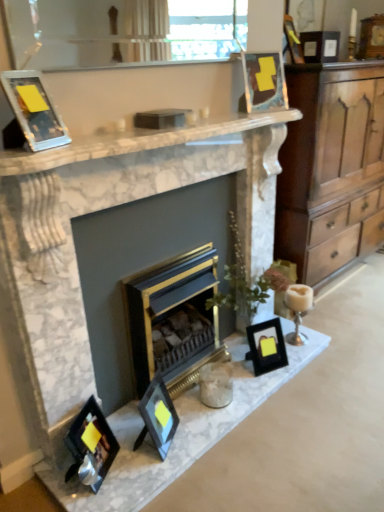
Question: Is the position of wooden picture frame at upper right, the 1th picture frame positioned from the back, less distant than that of marble fireplace at center, marked as the 2th fireplace in a right-to-left arrangement?

Choices:
 (A) no
 (B) yes

Answer: (A)

Question: Considering the relative sizes of wooden picture frame at upper right, placed as the seventh picture frame when sorted from left to right, and marble fireplace at center, marked as the first fireplace in a left-to-right arrangement, in the image provided, is wooden picture frame at upper right, placed as the seventh picture frame when sorted from left to right, taller than marble fireplace at center, marked as the first fireplace in a left-to-right arrangement,?

Choices:
 (A) no
 (B) yes

Answer: (A)

Question: Is wooden picture frame at upper right, acting as the seventh picture frame starting from the bottom, bigger than marble fireplace at center, marked as the 2th fireplace in a right-to-left arrangement?

Choices:
 (A) yes
 (B) no

Answer: (B)

Question: Is wooden picture frame at upper right, placed as the seventh picture frame when sorted from left to right, shorter than marble fireplace at center, marked as the first fireplace in a left-to-right arrangement?

Choices:
 (A) no
 (B) yes

Answer: (B)

Question: Is wooden picture frame at upper right, arranged as the 7th picture frame when viewed from the front, outside of marble fireplace at center, marked as the 2th fireplace in a right-to-left arrangement?

Choices:
 (A) yes
 (B) no

Answer: (A)

Question: Considering the relative positions of matte black picture frame at lower left, which is the 7th picture frame in top-to-bottom order, and matte glass picture frame at upper left, the 4th picture frame when ordered from top to bottom, in the image provided, is matte black picture frame at lower left, which is the 7th picture frame in top-to-bottom order, to the left or to the right of matte glass picture frame at upper left, the 4th picture frame when ordered from top to bottom,?

Choices:
 (A) left
 (B) right

Answer: (B)

Question: Does point (112, 437) appear closer or farther from the camera than point (11, 83)?

Choices:
 (A) farther
 (B) closer

Answer: (A)

Question: Considering their positions, is matte black picture frame at lower left, which is the 2th picture frame in left-to-right order, located in front of or behind matte glass picture frame at upper left, the 4th picture frame when ordered from top to bottom?

Choices:
 (A) front
 (B) behind

Answer: (B)

Question: From their relative heights in the image, would you say matte black picture frame at lower left, which is counted as the sixth picture frame, starting from the back, is taller or shorter than matte glass picture frame at upper left, which ranks as the 4th picture frame in bottom-to-top order?

Choices:
 (A) tall
 (B) short

Answer: (A)

Question: Considering the positions of clear glass window screen at upper center and metallic gold picture frame at upper center, which is counted as the fifth picture frame, starting from the bottom, in the image, is clear glass window screen at upper center taller or shorter than metallic gold picture frame at upper center, which is counted as the fifth picture frame, starting from the bottom,?

Choices:
 (A) tall
 (B) short

Answer: (A)

Question: From the image's perspective, is clear glass window screen at upper center above or below metallic gold picture frame at upper center, the 3th picture frame viewed from the top?

Choices:
 (A) below
 (B) above

Answer: (B)

Question: Relative to metallic gold picture frame at upper center, arranged as the fourth picture frame when viewed from the back, is clear glass window screen at upper center in front or behind?

Choices:
 (A) front
 (B) behind

Answer: (A)

Question: Which is correct: clear glass window screen at upper center is inside metallic gold picture frame at upper center, marked as the 4th picture frame in a left-to-right arrangement, or outside of it?

Choices:
 (A) inside
 (B) outside

Answer: (B)

Question: Is gold/black fireplace at center, which appears as the 2th fireplace when viewed from the left, bigger or smaller than clear glass window screen at upper center?

Choices:
 (A) big
 (B) small

Answer: (A)

Question: From the image's perspective, is gold/black fireplace at center, the 1th fireplace from the right, above or below clear glass window screen at upper center?

Choices:
 (A) below
 (B) above

Answer: (A)